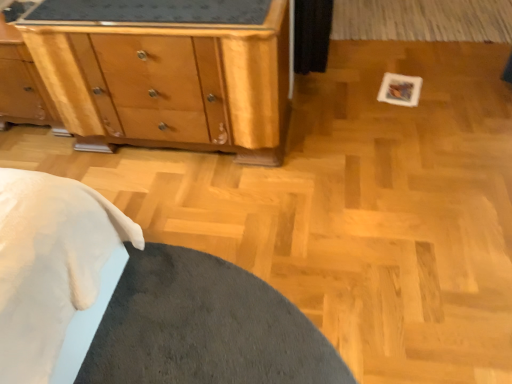
Locate an element on the screen. The image size is (512, 384). vacant space in front of light wood/finish chest of drawers at left is located at coordinates (193, 249).